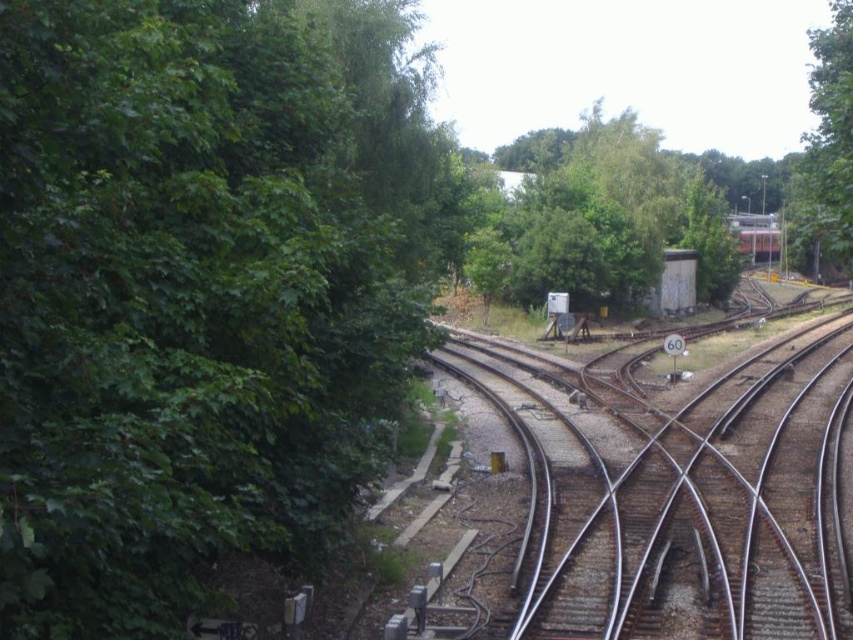
You are a train engineer operating the metallic red train at center. You notice a green leafy tree at upper right in your path. Can you safely pass through without hitting the tree?

The green leafy tree at upper right is 13.96 meters away from the metallic red train at center. Since the distance is sufficient, the train can safely pass without hitting the tree.

You are a train engineer approaching the railway junction. You notice two green leafy trees in the scene. Which tree would block your view if you were looking towards the upper right? The green leafy tree at left or the green leafy tree at upper right?

The green leafy tree at left is positioned under the green leafy tree at upper right, so the green leafy tree at left would block your view of the upper right tree.

You are a train engineer approaching the railway junction. You see two points marked on your map at coordinates point (791, 179) and point (775, 257). Which point is closer to your current position if you are approaching from the direction of the speed limit sign?

Point (775, 257) is closer to your current position because point (791, 179) is behind it according to the given coordinates.